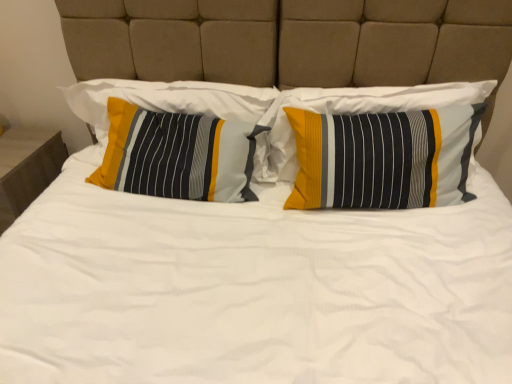
Question: From the image's perspective, is textured striped pillow at left, the 2th pillow positioned from the right, on matte wood nightstand at left?

Choices:
 (A) yes
 (B) no

Answer: (A)

Question: Can you confirm if textured striped pillow at left, the 2th pillow positioned from the right, is thinner than matte wood nightstand at left?

Choices:
 (A) no
 (B) yes

Answer: (B)

Question: Is textured striped pillow at left, the 2th pillow positioned from the right, taller than matte wood nightstand at left?

Choices:
 (A) no
 (B) yes

Answer: (A)

Question: Is textured striped pillow at left, the 2th pillow positioned from the right, at the left side of matte wood nightstand at left?

Choices:
 (A) no
 (B) yes

Answer: (A)

Question: Is textured striped pillow at left, the 2th pillow positioned from the right, at the right side of matte wood nightstand at left?

Choices:
 (A) no
 (B) yes

Answer: (B)

Question: From the image's perspective, is textured striped pillow at left, marked as the 1th pillow in a left-to-right arrangement, positioned above or below textured striped pillow at left, which is the 2th pillow from left to right?

Choices:
 (A) below
 (B) above

Answer: (B)

Question: From a real-world perspective, relative to textured striped pillow at left, which is the 2th pillow from left to right, is textured striped pillow at left, the 3th pillow from the right, vertically above or below?

Choices:
 (A) below
 (B) above

Answer: (B)

Question: Looking at their shapes, would you say textured striped pillow at left, marked as the 1th pillow in a left-to-right arrangement, is wider or thinner than textured striped pillow at left, which is the 2th pillow from left to right?

Choices:
 (A) thin
 (B) wide

Answer: (A)

Question: In the image, is textured striped pillow at left, marked as the 1th pillow in a left-to-right arrangement, positioned in front of or behind textured striped pillow at left, the 2th pillow positioned from the right?

Choices:
 (A) behind
 (B) front

Answer: (A)

Question: From the image's perspective, is textured striped pillow at left, the 2th pillow positioned from the right, above or below textured cotton pillow at center, placed as the 1th pillow when sorted from right to left?

Choices:
 (A) above
 (B) below

Answer: (B)

Question: Looking at their shapes, would you say textured striped pillow at left, which is the 2th pillow from left to right, is wider or thinner than textured cotton pillow at center, placed as the 1th pillow when sorted from right to left?

Choices:
 (A) thin
 (B) wide

Answer: (B)

Question: In terms of height, does textured striped pillow at left, the 2th pillow positioned from the right, look taller or shorter compared to textured cotton pillow at center, the third pillow positioned from the left?

Choices:
 (A) tall
 (B) short

Answer: (B)

Question: Considering the positions of textured striped pillow at left, which is the 2th pillow from left to right, and textured cotton pillow at center, the third pillow positioned from the left, in the image, is textured striped pillow at left, which is the 2th pillow from left to right, bigger or smaller than textured cotton pillow at center, the third pillow positioned from the left,?

Choices:
 (A) small
 (B) big

Answer: (A)

Question: From the image's perspective, is textured striped pillow at left, marked as the 1th pillow in a left-to-right arrangement, located above or below matte wood nightstand at left?

Choices:
 (A) below
 (B) above

Answer: (B)

Question: Considering the positions of textured striped pillow at left, marked as the 1th pillow in a left-to-right arrangement, and matte wood nightstand at left in the image, is textured striped pillow at left, marked as the 1th pillow in a left-to-right arrangement, bigger or smaller than matte wood nightstand at left?

Choices:
 (A) big
 (B) small

Answer: (B)